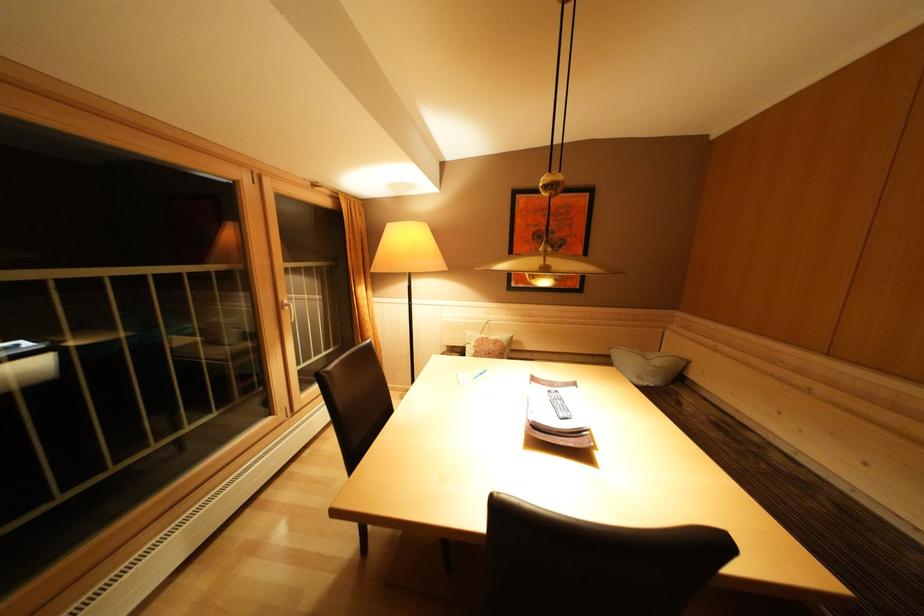
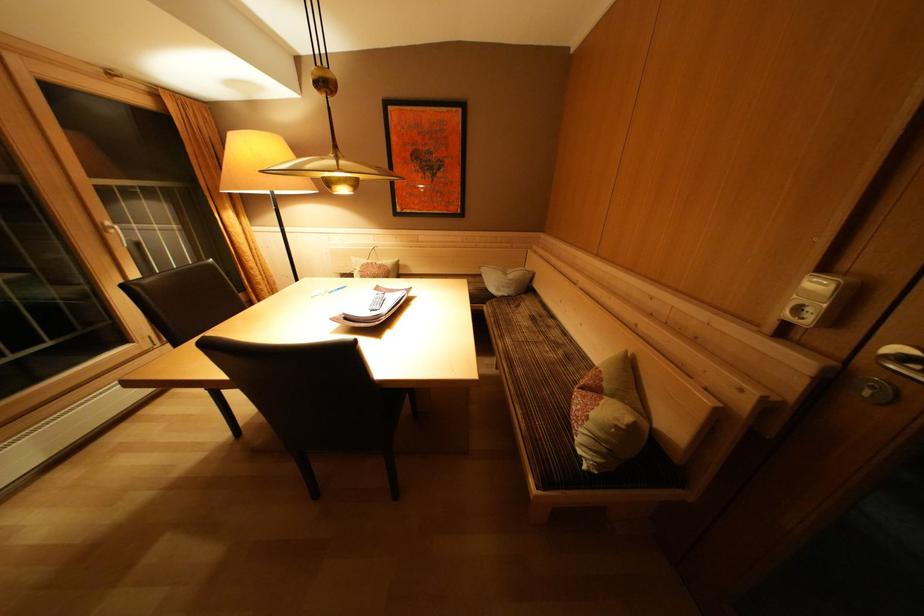
In the second image, find the point that corresponds to (x=293, y=307) in the first image.

(116, 229)